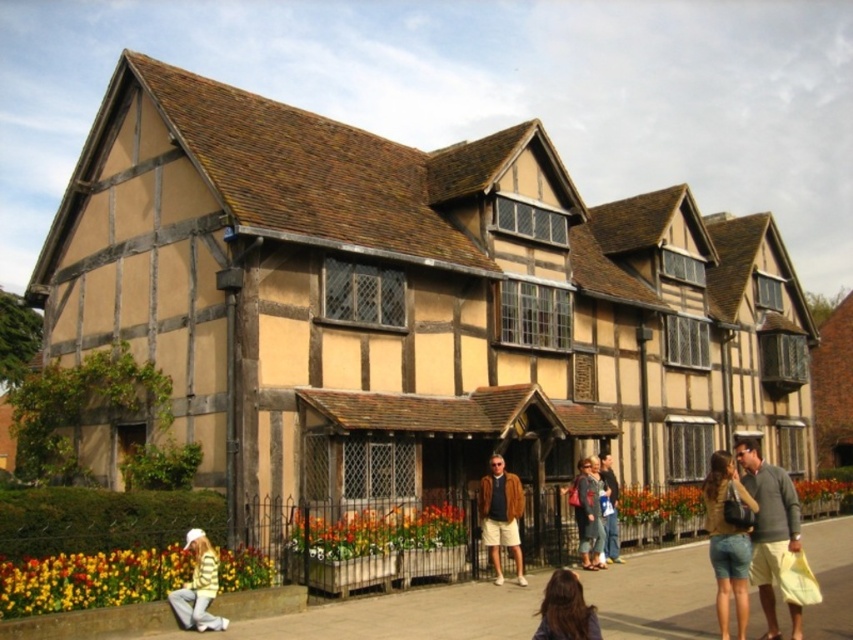
Which is behind, point (177, 628) or point (572, 600)?

Positioned behind is point (177, 628).

Is paved concrete sidewalk at lower center further to camera compared to dark brown hair at lower center?

Yes, paved concrete sidewalk at lower center is further from the viewer.

Image resolution: width=853 pixels, height=640 pixels. Describe the element at coordinates (317, 616) in the screenshot. I see `paved concrete sidewalk at lower center` at that location.

In order to click on paved concrete sidewalk at lower center in this screenshot , I will do `click(317, 616)`.

Between point (490, 538) and point (589, 620), which one is positioned in front?

Point (589, 620) is more forward.

Can you confirm if brown fur coat at center is smaller than dark brown hair at lower center?

Correct, brown fur coat at center occupies less space than dark brown hair at lower center.

Does point (483, 524) come behind point (578, 589)?

Yes.

Where is `brown fur coat at center`? brown fur coat at center is located at coordinates (502, 515).

Can you confirm if light brown sweater at center is taller than brown fur coat at center?

Yes.

Is point (776, 540) positioned in front of point (492, 525)?

Yes, point (776, 540) is closer to viewer.

At what (x,y) coordinates should I click in order to perform the action: click on light brown sweater at center. Please return your answer as a coordinate pair (x, y). The image size is (853, 640). Looking at the image, I should click on (769, 524).

This screenshot has width=853, height=640. I want to click on light brown sweater at center, so pos(769,524).